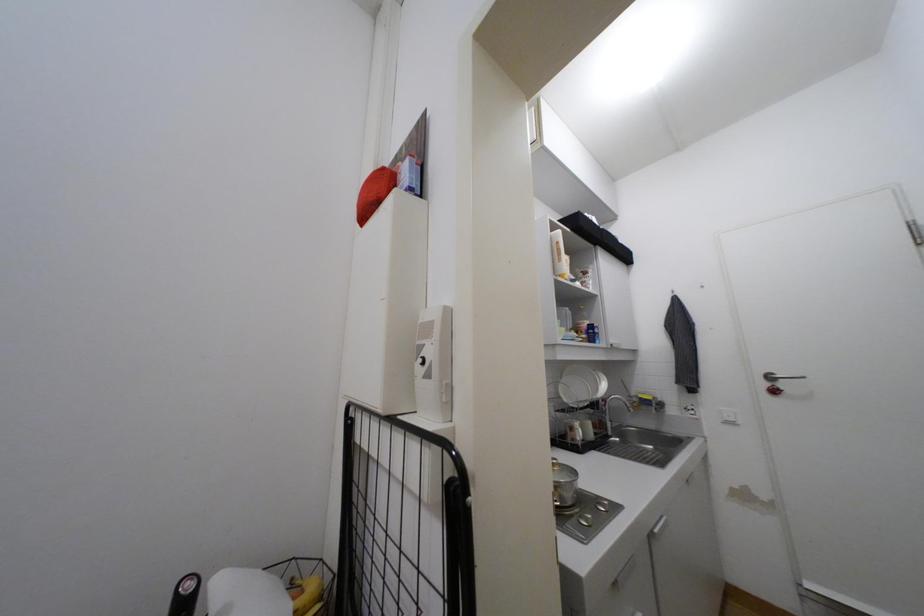
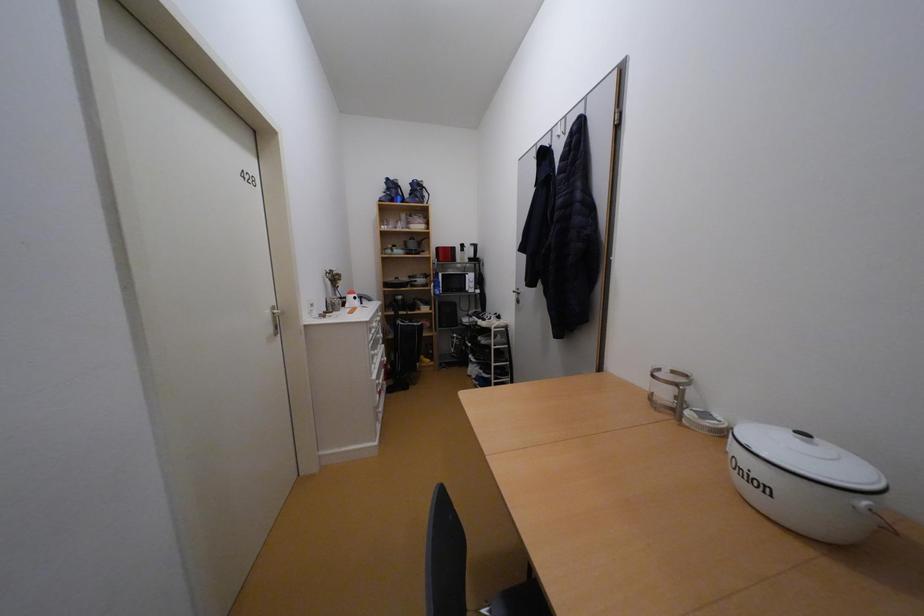
Question: The first image is from the beginning of the video and the second image is from the end. How did the camera likely rotate when shooting the video?

Choices:
 (A) Left
 (B) Right
 (C) Up
 (D) Down

Answer: (A)